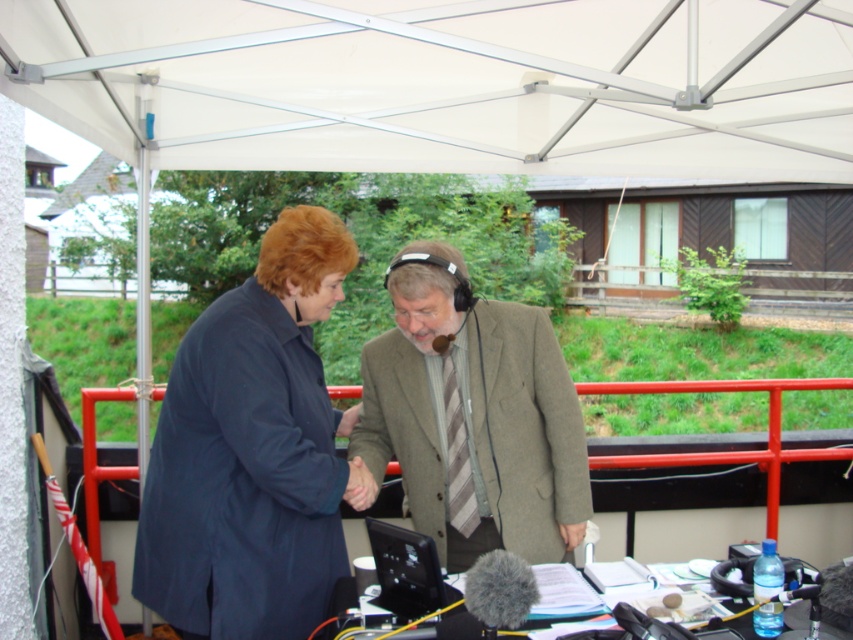
You are attending an outdoor event and notice two coats hanging on a rack near the entrance. The dark blue coat at center and the light brown textured coat at center. Which coat is placed higher on the rack?

The light brown textured coat at center is placed higher on the rack because the dark blue coat at center is positioned under it.

Based on the coordinates provided, what object is located at point (447, 83) in the image?

The point (447, 83) corresponds to the white fabric canopy at upper center.

You are planning to hang a banner under the white fabric canopy at upper center. The banner is as wide as the dark blue coat at center. Will the banner fit under the canopy without needing to be trimmed?

The white fabric canopy at upper center might be wider than the dark blue coat at center, so the banner, which is as wide as the dark blue coat at center, should fit under the canopy without needing to be trimmed.